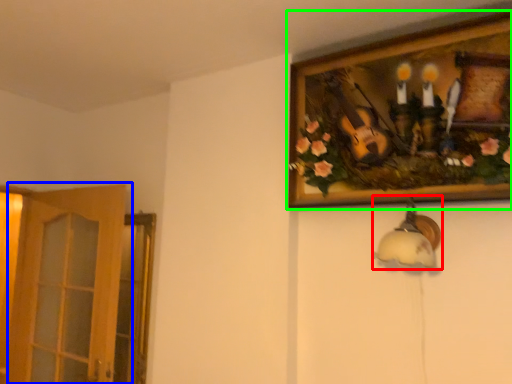
Question: Which object is the closest to the lamp (highlighted by a red box)? Choose among these: door (highlighted by a blue box) or picture frame (highlighted by a green box).

Choices:
 (A) door
 (B) picture frame

Answer: (B)